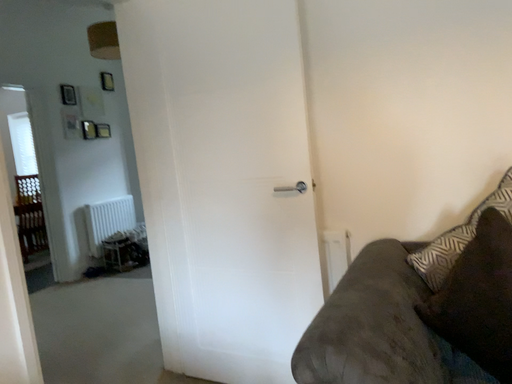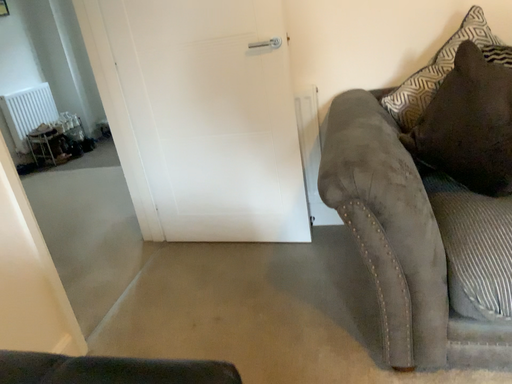
Question: How did the camera likely rotate when shooting the video?

Choices:
 (A) rotated upward
 (B) rotated downward

Answer: (B)